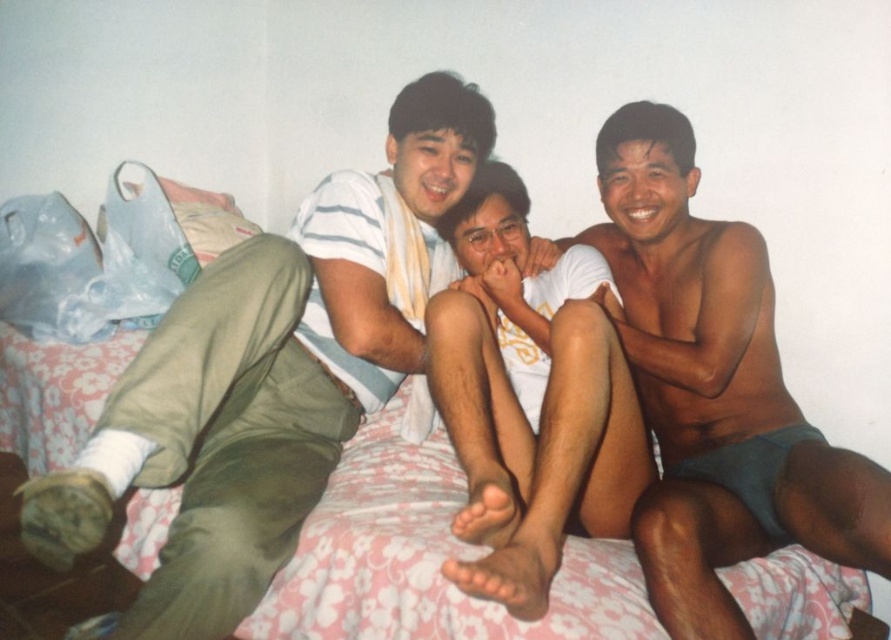
Is smooth skin torso at center above white cotton shirt at center?

No, smooth skin torso at center is not above white cotton shirt at center.

Who is positioned more to the left, smooth skin torso at center or white cotton shirt at center?

white cotton shirt at center

Between point (815, 502) and point (497, 429), which one is positioned behind?

Positioned behind is point (497, 429).

Where is `smooth skin torso at center`? Image resolution: width=891 pixels, height=640 pixels. smooth skin torso at center is located at coordinates (715, 390).

Is point (203, 570) positioned in front of point (438, 333)?

Yes, it is in front of point (438, 333).

Is matte khaki pants at center in front of white cotton shirt at center?

No, it is behind white cotton shirt at center.

Between point (411, 314) and point (511, 218), which one is positioned in front?

Positioned in front is point (411, 314).

I want to click on matte khaki pants at center, so click(x=268, y=376).

Between point (296, 272) and point (759, 480), which one is positioned behind?

Point (759, 480)

Image resolution: width=891 pixels, height=640 pixels. I want to click on matte khaki pants at center, so click(x=268, y=376).